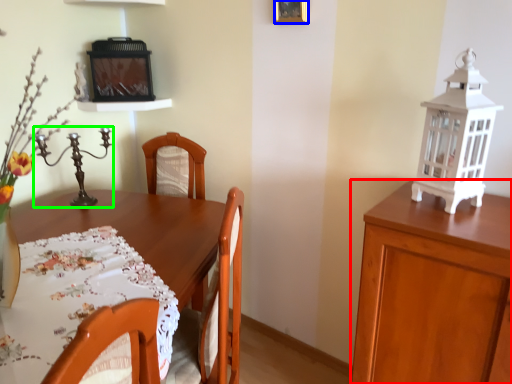
Question: Which is nearer to the cabinetry (highlighted by a red box)? picture frame (highlighted by a blue box) or candle holder (highlighted by a green box).

Choices:
 (A) picture frame
 (B) candle holder

Answer: (A)